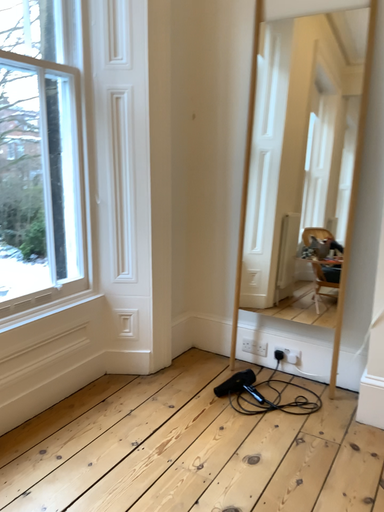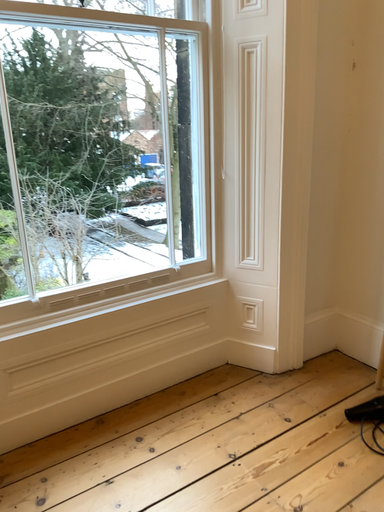
Question: How did the camera likely rotate when shooting the video?

Choices:
 (A) rotated right
 (B) rotated left

Answer: (B)